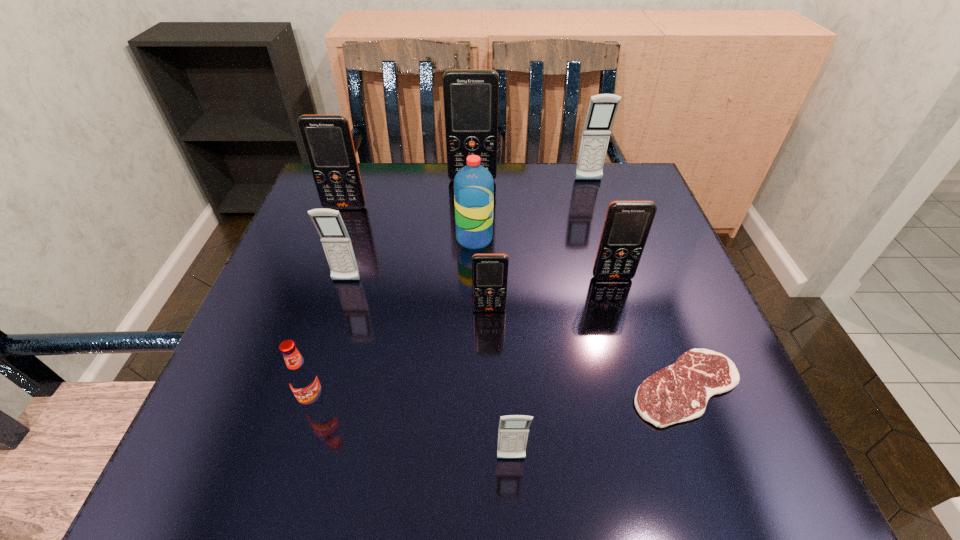
Point out which object is positioned as the second nearest to the second nearest gray cellular telephone. Please provide its 2D coordinates. Your answer should be formatted as a tuple, i.e. [(x, y)], where the tuple contains the x and y coordinates of a point satisfying the conditions above.

[(327, 139)]

Select which cellular telephone is the fifth closest to the seventh farthest object. Please provide its 2D coordinates. Your answer should be formatted as a tuple, i.e. [(x, y)], where the tuple contains the x and y coordinates of a point satisfying the conditions above.

[(471, 97)]

Where is `cellular telephone identified as the sixth closest to the root beer`? This screenshot has width=960, height=540. cellular telephone identified as the sixth closest to the root beer is located at coordinates (471, 97).

In order to click on the second closest orange cellular telephone to the second nearest orange cellular telephone in this screenshot , I will do `click(471, 97)`.

Locate which orange cellular telephone ranks third in proximity to the fourth farthest object. Please provide its 2D coordinates. Your answer should be formatted as a tuple, i.e. [(x, y)], where the tuple contains the x and y coordinates of a point satisfying the conditions above.

[(627, 224)]

This screenshot has height=540, width=960. Identify the location of gray cellular telephone object that ranks as the closest to the farthest gray cellular telephone. (335, 239).

Identify the location of gray cellular telephone that is the second nearest to the shortest object. (335, 239).

Locate an element on the screen. Image resolution: width=960 pixels, height=540 pixels. blank space that satisfies the following two spatial constraints: 1. on the screen of the biggest orange cellular telephone; 2. on the left side of the steak is located at coordinates point(468,388).

The height and width of the screenshot is (540, 960). In order to click on vacant point that satisfies the following two spatial constraints: 1. on the screen of the third farthest object; 2. on the left side of the root beer in this screenshot , I will do `click(275, 402)`.

Find the location of a particular element. This screenshot has height=540, width=960. vacant space that satisfies the following two spatial constraints: 1. on the screen of the red steak; 2. on the left side of the eighth nearest object is located at coordinates (280, 388).